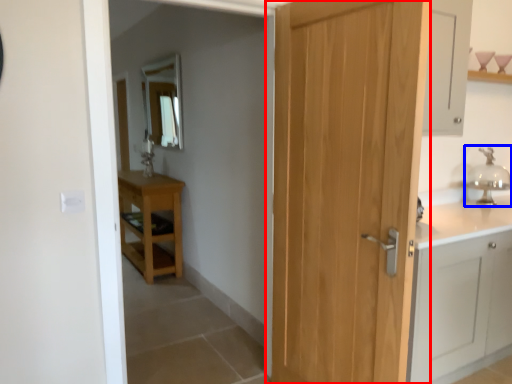
Question: Which point is closer to the camera, door (highlighted by a red box) or faucet (highlighted by a blue box)?

Choices:
 (A) door
 (B) faucet

Answer: (A)